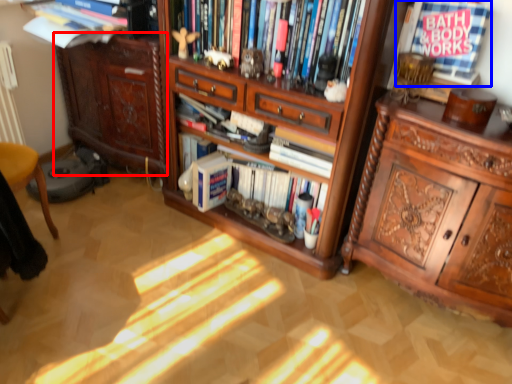
Question: Among these objects, which one is farthest to the camera, cabinetry (highlighted by a red box) or book (highlighted by a blue box)?

Choices:
 (A) cabinetry
 (B) book

Answer: (A)